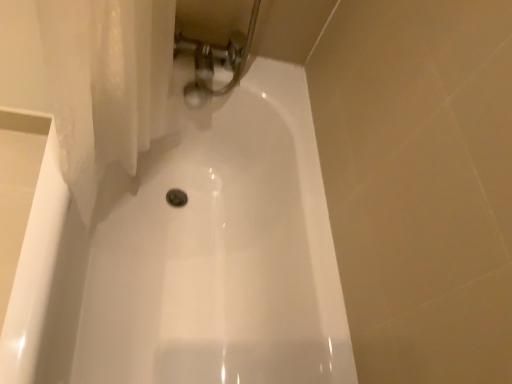
Question: Is white glossy bathtub at center positioned far away from polished chrome faucet at upper center?

Choices:
 (A) no
 (B) yes

Answer: (A)

Question: Is white glossy bathtub at center with polished chrome faucet at upper center?

Choices:
 (A) yes
 (B) no

Answer: (B)

Question: Is white glossy bathtub at center surrounding polished chrome faucet at upper center?

Choices:
 (A) no
 (B) yes

Answer: (B)

Question: Does white glossy bathtub at center turn towards polished chrome faucet at upper center?

Choices:
 (A) no
 (B) yes

Answer: (A)

Question: Is white glossy bathtub at center looking in the opposite direction of polished chrome faucet at upper center?

Choices:
 (A) no
 (B) yes

Answer: (A)

Question: From a real-world perspective, is white glossy bathtub at center under polished chrome faucet at upper center?

Choices:
 (A) yes
 (B) no

Answer: (A)

Question: Is polished chrome faucet at upper center next to white glossy bathtub at center and touching it?

Choices:
 (A) no
 (B) yes

Answer: (A)

Question: Is polished chrome faucet at upper center to the right of white glossy bathtub at center from the viewer's perspective?

Choices:
 (A) yes
 (B) no

Answer: (A)

Question: Is polished chrome faucet at upper center oriented towards white glossy bathtub at center?

Choices:
 (A) yes
 (B) no

Answer: (B)

Question: From a real-world perspective, does polished chrome faucet at upper center stand above white glossy bathtub at center?

Choices:
 (A) yes
 (B) no

Answer: (A)

Question: Is polished chrome faucet at upper center in front of white glossy bathtub at center?

Choices:
 (A) yes
 (B) no

Answer: (B)

Question: Is polished chrome faucet at upper center wider than white glossy bathtub at center?

Choices:
 (A) no
 (B) yes

Answer: (A)

Question: From their relative heights in the image, would you say polished chrome faucet at upper center is taller or shorter than white glossy bathtub at center?

Choices:
 (A) short
 (B) tall

Answer: (A)